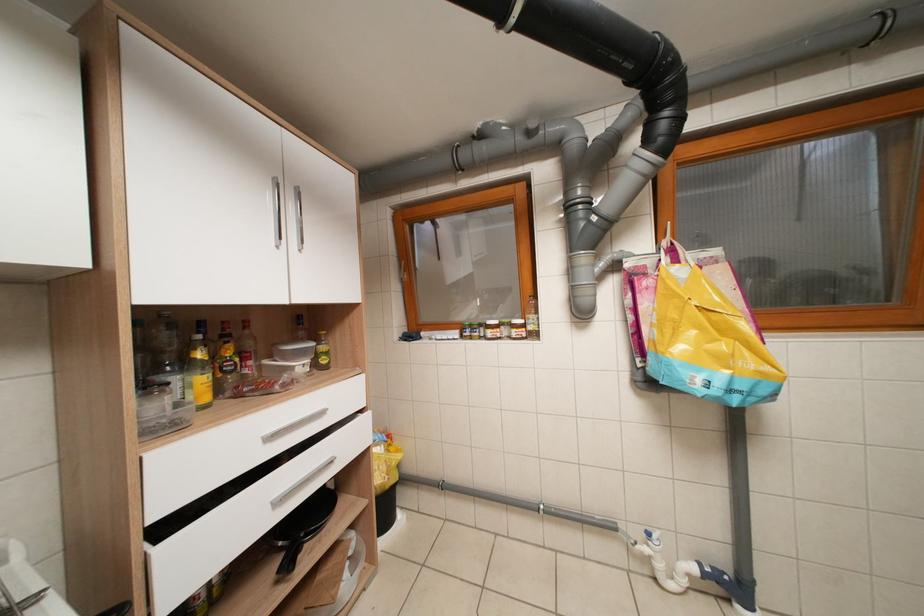
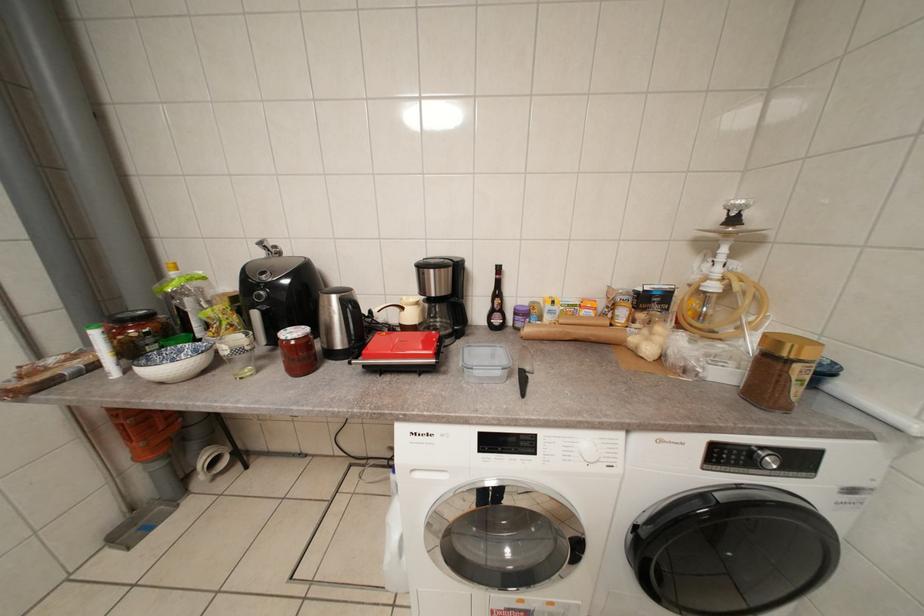
Question: The first image is from the beginning of the video and the second image is from the end. How did the camera likely rotate when shooting the video?

Choices:
 (A) Left
 (B) Right
 (C) Up
 (D) Down

Answer: (B)